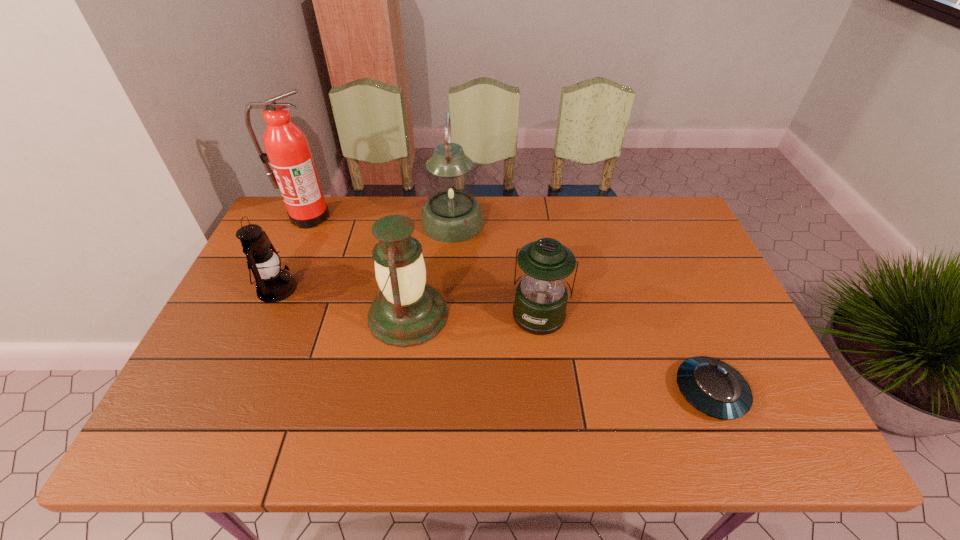
Identify the location of vacant space located 0.320m with the light compartment facing forward on the fourth shortest object. (569, 315).

Where is `free location located on the side of the leftmost lantern, there is a wick adjustment knob`? Image resolution: width=960 pixels, height=540 pixels. free location located on the side of the leftmost lantern, there is a wick adjustment knob is located at coordinates (314, 288).

Image resolution: width=960 pixels, height=540 pixels. In order to click on free region located on the right of the rightmost lantern in this screenshot , I will do `click(597, 314)`.

I want to click on free space located 0.170m on the left of the shortest object, so click(601, 392).

I want to click on fire extinguisher that is positioned at the far edge, so click(293, 171).

At what (x,y) coordinates should I click in order to perform the action: click on lantern that is at the far edge. Please return your answer as a coordinate pair (x, y). Looking at the image, I should click on (451, 214).

Where is `object that is at the near edge`? Image resolution: width=960 pixels, height=540 pixels. object that is at the near edge is located at coordinates (713, 387).

The image size is (960, 540). I want to click on fire extinguisher that is positioned at the left edge, so click(293, 171).

You are a GUI agent. You are given a task and a screenshot of the screen. Output one action in this format:
    pyautogui.click(x=<x>, y=<y>)
    Task: Click on the lantern positioned at the left edge
    
    Given the screenshot: What is the action you would take?
    pyautogui.click(x=273, y=284)

Find the location of `object positioned at the right edge`. object positioned at the right edge is located at coordinates click(x=713, y=387).